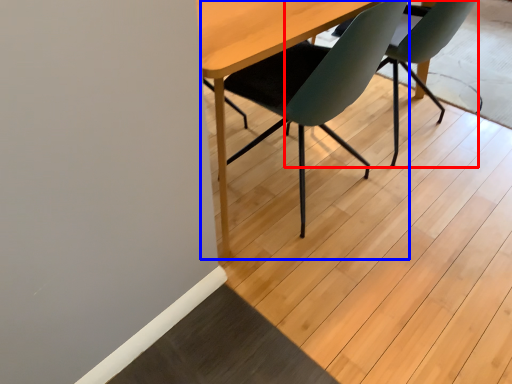
Question: Among these objects, which one is nearest to the camera, chair (highlighted by a red box) or chair (highlighted by a blue box)?

Choices:
 (A) chair
 (B) chair

Answer: (B)